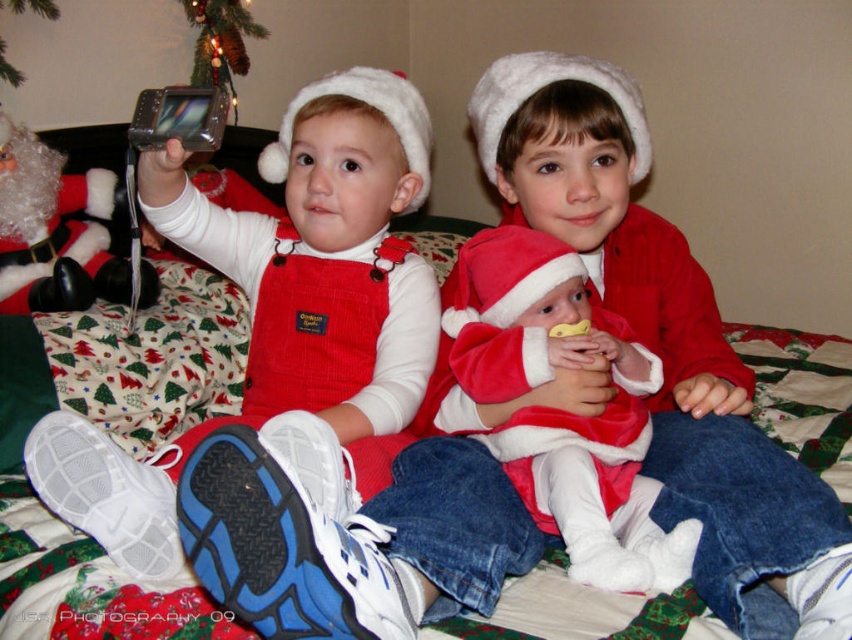
Question: Does corduroy red overalls at left appear over fuzzy white santa at left?

Choices:
 (A) yes
 (B) no

Answer: (B)

Question: Which is nearer to the fuzzy white santa at left?

Choices:
 (A) velvet red santa suit at center
 (B) corduroy red overalls at left

Answer: (B)

Question: Can you confirm if corduroy red overalls at left is positioned below fuzzy white santa at left?

Choices:
 (A) yes
 (B) no

Answer: (A)

Question: Does corduroy red overalls at left have a greater width compared to velvet red santa suit at center?

Choices:
 (A) no
 (B) yes

Answer: (B)

Question: Which object appears farthest from the camera in this image?

Choices:
 (A) fuzzy white santa at left
 (B) velvet red santa suit at center

Answer: (A)

Question: Considering the real-world distances, which object is closest to the corduroy red overalls at left?

Choices:
 (A) matte red overalls at lower left
 (B) fuzzy white santa at left

Answer: (A)